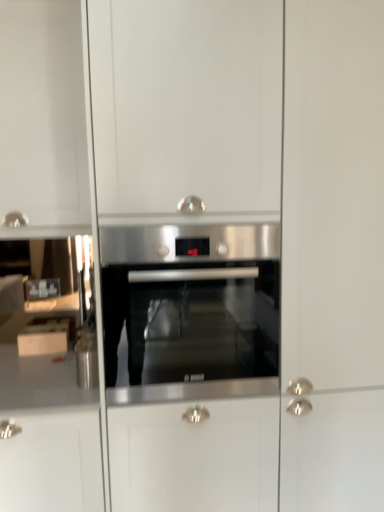
Question: Is white glossy cabinet at left in front of or behind stainless steel oven at center in the image?

Choices:
 (A) front
 (B) behind

Answer: (B)

Question: Considering the positions of white glossy cabinet at left and stainless steel oven at center in the image, is white glossy cabinet at left wider or thinner than stainless steel oven at center?

Choices:
 (A) thin
 (B) wide

Answer: (A)

Question: From a real-world perspective, is white glossy cabinet at left physically located above or below stainless steel oven at center?

Choices:
 (A) above
 (B) below

Answer: (B)

Question: From the image's perspective, is stainless steel oven at center located above or below white glossy cabinet at left?

Choices:
 (A) above
 (B) below

Answer: (A)

Question: Considering the positions of point (215, 232) and point (52, 332), is point (215, 232) closer or farther from the camera than point (52, 332)?

Choices:
 (A) closer
 (B) farther

Answer: (A)

Question: From a real-world perspective, relative to white glossy cabinet at left, is stainless steel oven at center vertically above or below?

Choices:
 (A) above
 (B) below

Answer: (A)

Question: Which is correct: stainless steel oven at center is inside white glossy cabinet at left, or outside of it?

Choices:
 (A) outside
 (B) inside

Answer: (A)